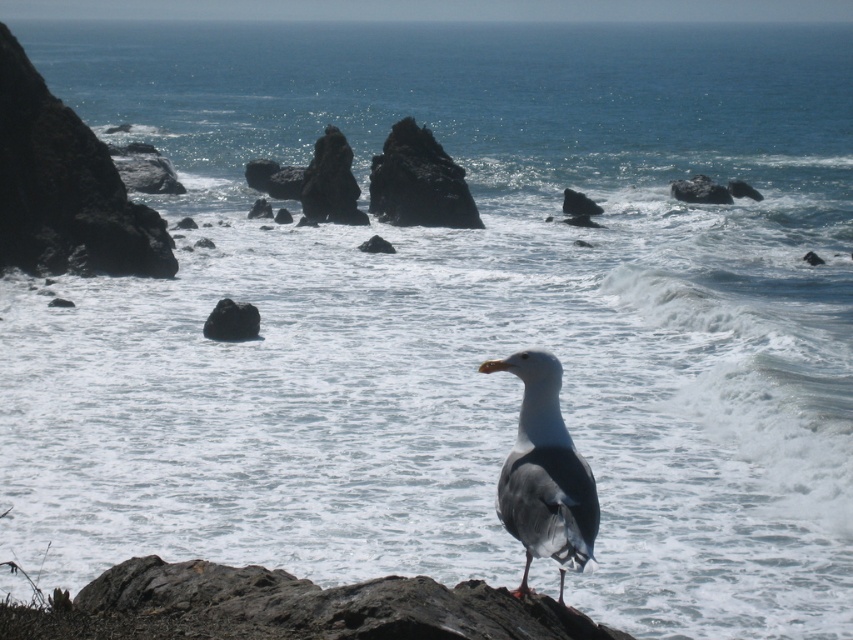
Question: Which point is farther from the camera taking this photo?

Choices:
 (A) (531, 452)
 (B) (219, 300)

Answer: (B)

Question: Does gray matte seagull at center appear under rough textured rock at center?

Choices:
 (A) yes
 (B) no

Answer: (A)

Question: Is gray matte seagull at center closer to camera compared to rough textured rock at center?

Choices:
 (A) yes
 (B) no

Answer: (A)

Question: Is gray matte seagull at center above rough textured rock at center?

Choices:
 (A) no
 (B) yes

Answer: (A)